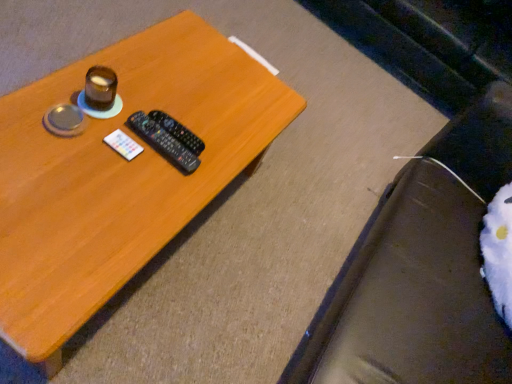
Question: Considering the relative sizes of black plastic remote at center, placed as the second remote control when sorted from back to front, and black plastic remote control at center, the 1th remote control viewed from the back, in the image provided, is black plastic remote at center, placed as the second remote control when sorted from back to front, shorter than black plastic remote control at center, the 1th remote control viewed from the back,?

Choices:
 (A) yes
 (B) no

Answer: (B)

Question: From the image's perspective, is black plastic remote at center, placed as the second remote control when sorted from back to front, below black plastic remote control at center, placed as the second remote control when sorted from front to back?

Choices:
 (A) no
 (B) yes

Answer: (B)

Question: Is black plastic remote at center, placed as the second remote control when sorted from back to front, at the left side of black plastic remote control at center, the 1th remote control viewed from the back?

Choices:
 (A) yes
 (B) no

Answer: (A)

Question: From a real-world perspective, is black plastic remote at center, which is the 1th remote control in front-to-back order, over black plastic remote control at center, the 1th remote control viewed from the back?

Choices:
 (A) yes
 (B) no

Answer: (A)

Question: Is black plastic remote at center, placed as the second remote control when sorted from back to front, closer to camera compared to black plastic remote control at center, placed as the second remote control when sorted from front to back?

Choices:
 (A) no
 (B) yes

Answer: (B)

Question: From the image's perspective, is wooden table at center located above or below black plastic remote control at center, placed as the second remote control when sorted from front to back?

Choices:
 (A) below
 (B) above

Answer: (A)

Question: Is wooden table at center in front of or behind black plastic remote control at center, the 1th remote control viewed from the back, in the image?

Choices:
 (A) behind
 (B) front

Answer: (B)

Question: Visually, is wooden table at center positioned to the left or to the right of black plastic remote control at center, placed as the second remote control when sorted from front to back?

Choices:
 (A) right
 (B) left

Answer: (B)

Question: Based on their sizes in the image, would you say wooden table at center is bigger or smaller than black plastic remote control at center, placed as the second remote control when sorted from front to back?

Choices:
 (A) small
 (B) big

Answer: (B)

Question: From the image's perspective, relative to black plastic remote control at center, placed as the second remote control when sorted from front to back, is black plastic remote at center, which is the 1th remote control in front-to-back order, above or below?

Choices:
 (A) below
 (B) above

Answer: (A)

Question: Is point (193, 170) closer or farther from the camera than point (186, 142)?

Choices:
 (A) farther
 (B) closer

Answer: (B)

Question: Which is correct: black plastic remote at center, placed as the second remote control when sorted from back to front, is inside black plastic remote control at center, placed as the second remote control when sorted from front to back, or outside of it?

Choices:
 (A) inside
 (B) outside

Answer: (B)

Question: Is black plastic remote at center, placed as the second remote control when sorted from back to front, in front of or behind black plastic remote control at center, placed as the second remote control when sorted from front to back, in the image?

Choices:
 (A) front
 (B) behind

Answer: (A)

Question: In terms of width, does wooden table at center look wider or thinner when compared to white fuzzy bean bag chair at lower right?

Choices:
 (A) wide
 (B) thin

Answer: (B)

Question: Relative to white fuzzy bean bag chair at lower right, is wooden table at center in front or behind?

Choices:
 (A) behind
 (B) front

Answer: (A)